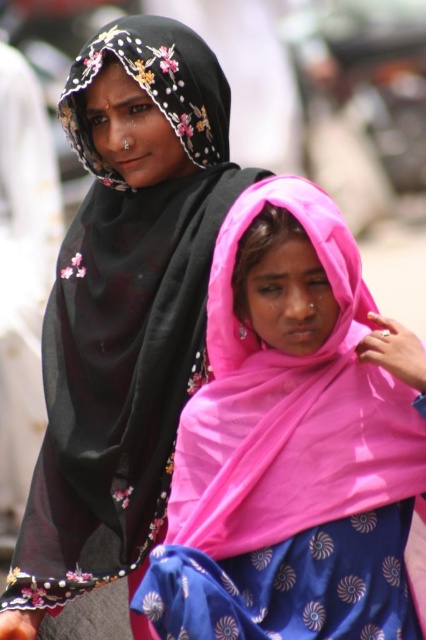
You are a fashion designer observing the two headscarves in the image. Which of the two, the pink satin scarf at center or the black sheer headscarf at upper left, is shorter in height?

The pink satin scarf at center has a lesser height compared to the black sheer headscarf at upper left, so the pink satin scarf at center is shorter in height.

You are an assistant helping someone choose between two black sheer scarves for an event. The two options are the black sheer scarf at upper left and the black sheer headscarf at upper left. Which one is positioned more to the left in the image?

The black sheer scarf at upper left is positioned more to the left than the black sheer headscarf at upper left.